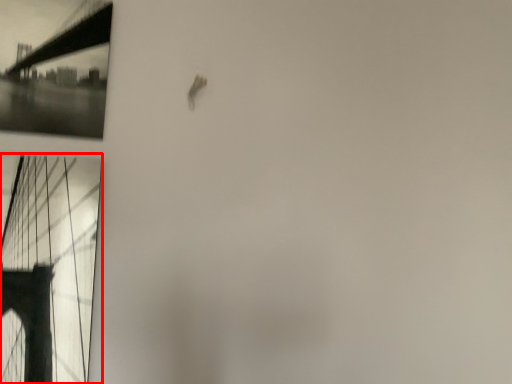
Question: Where is window (annotated by the red box) located in relation to suspension bridge in the image?

Choices:
 (A) right
 (B) left

Answer: (A)